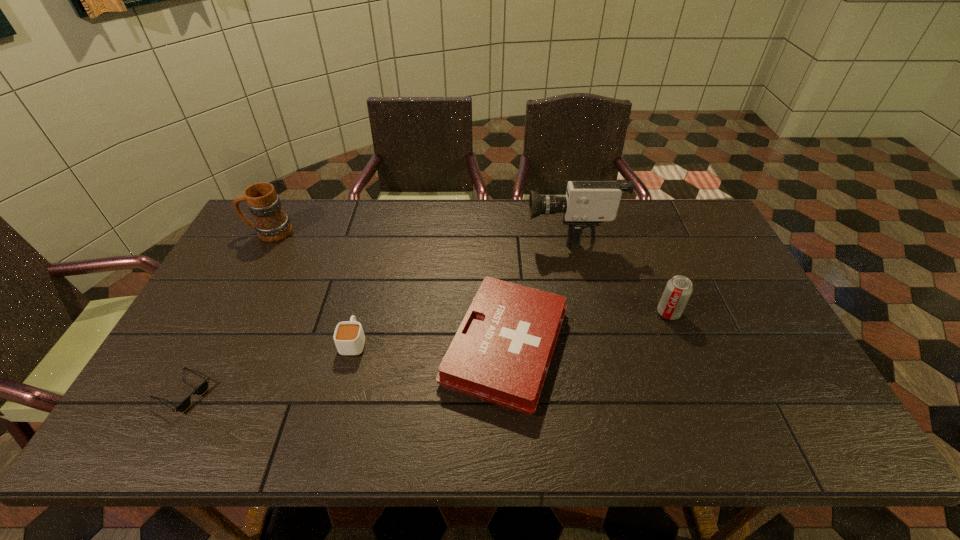
Find the location of a particular element. The height and width of the screenshot is (540, 960). mug that is at the left edge is located at coordinates (271, 223).

You are a GUI agent. You are given a task and a screenshot of the screen. Output one action in this format:
    pyautogui.click(x=<x>, y=<y>)
    Task: Click on the sunglasses at the left edge
    
    Given the screenshot: What is the action you would take?
    pyautogui.click(x=200, y=390)

Find the location of a particular element. object that is at the far left corner is located at coordinates (271, 223).

At what (x,y) coordinates should I click in order to perform the action: click on object present at the near left corner. Please return your answer as a coordinate pair (x, y). Looking at the image, I should click on (200, 390).

Identify the location of vacant space at the far edge of the desktop. This screenshot has height=540, width=960. (338, 202).

Identify the location of vacant space at the near edge. (431, 440).

Where is `vacant space at the left edge`? The image size is (960, 540). vacant space at the left edge is located at coordinates (254, 247).

Where is `free space at the right edge`? free space at the right edge is located at coordinates (745, 288).

At what (x,y) coordinates should I click in order to perform the action: click on free space at the far left corner. Please return your answer as a coordinate pair (x, y). This screenshot has height=540, width=960. Looking at the image, I should click on (297, 215).

I want to click on vacant area at the far right corner, so click(668, 212).